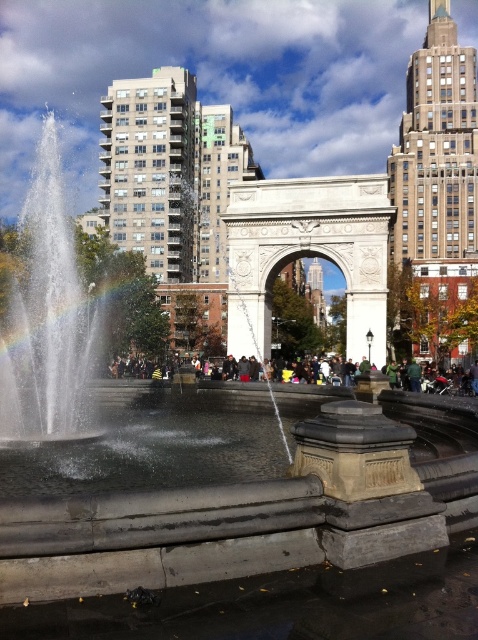
Looking at this image, you are standing in the Washington Square Arch area and see a rainbow in the sky. There is a point at coordinates point (119, 304). Is this point located on the rainbow?

Yes, the point (119, 304) is on the rainbow at center, so the point is located on the rainbow.

You are an artist planning to paint the scene. You notice the rainbow at center and the dark green fabric at center. Which object should you paint first if you want to paint the taller one first?

The rainbow at center has a greater height compared to the dark green fabric at center, so you should paint the rainbow at center first.